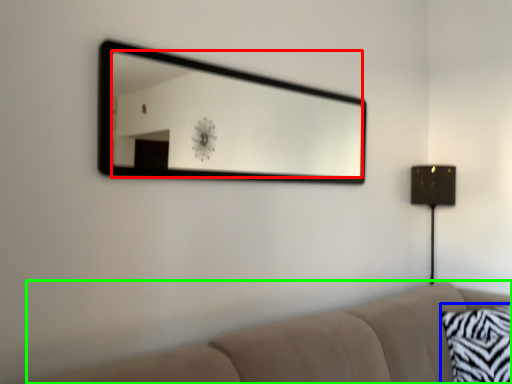
Question: Based on their relative distances, which object is farther from mirror (highlighted by a red box)? Choose from pillow (highlighted by a blue box) and studio couch (highlighted by a green box).

Choices:
 (A) pillow
 (B) studio couch

Answer: (B)